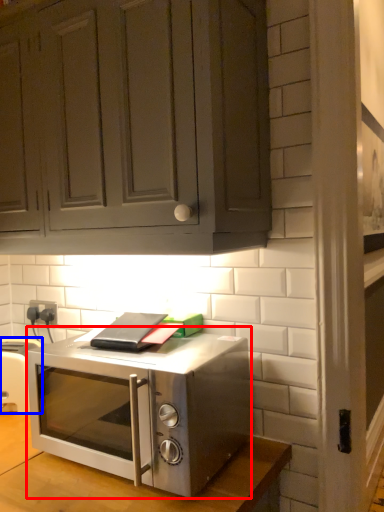
Question: Which object is closer to the camera taking this photo, microwave oven (highlighted by a red box) or appliance (highlighted by a blue box)?

Choices:
 (A) microwave oven
 (B) appliance

Answer: (A)